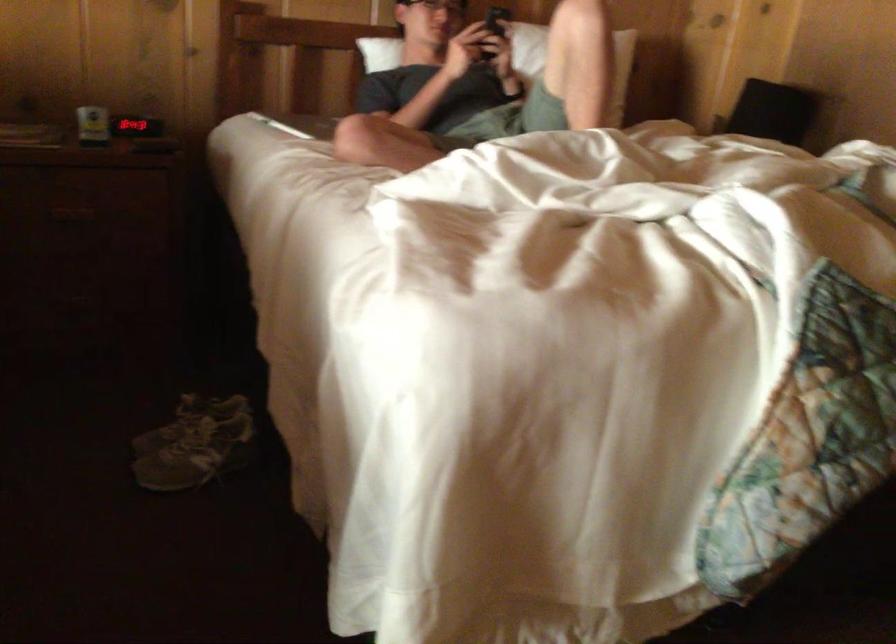
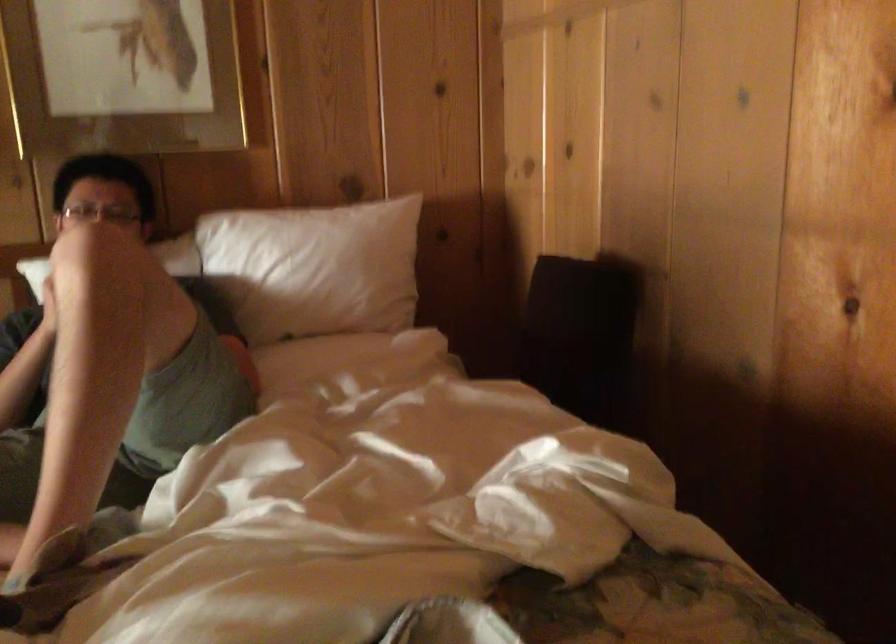
What movement of the cameraman would produce the second image?

The movement direction of the cameraman is right, forward.